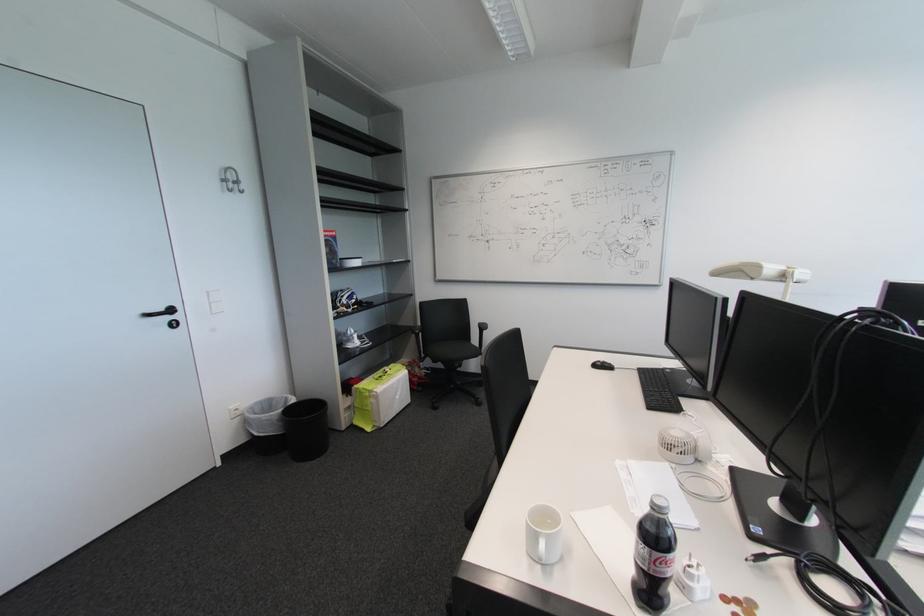
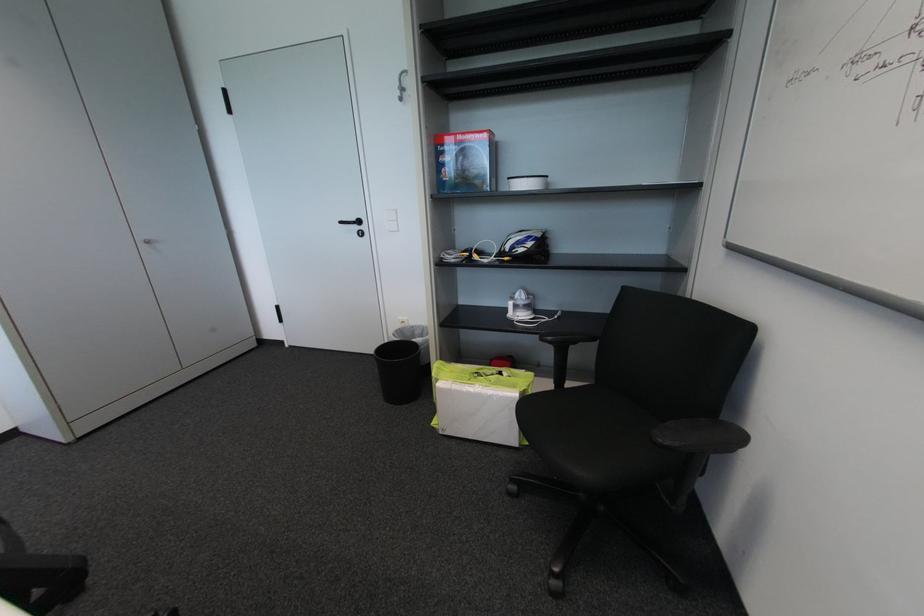
Locate, in the second image, the point that corresponds to point (175, 320) in the first image.

(362, 229)